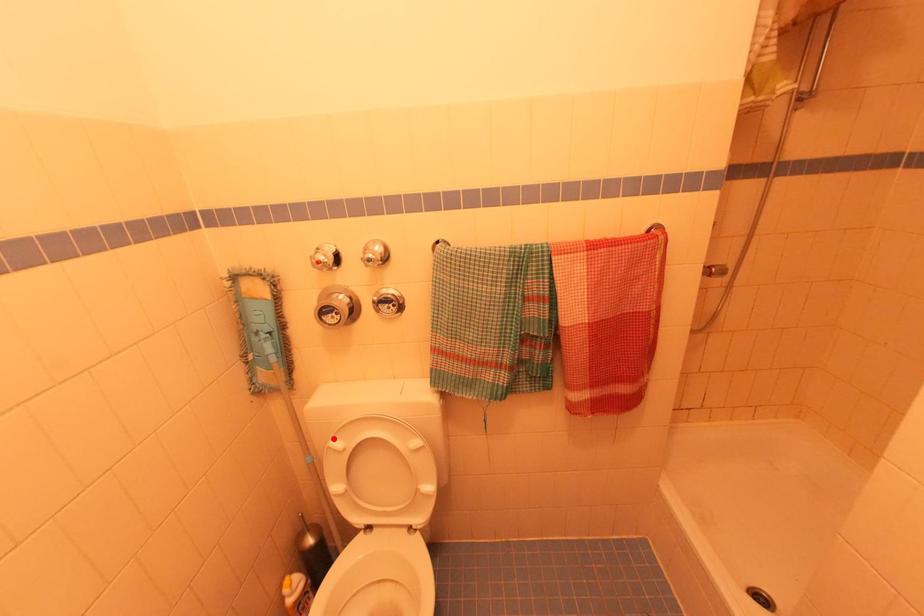
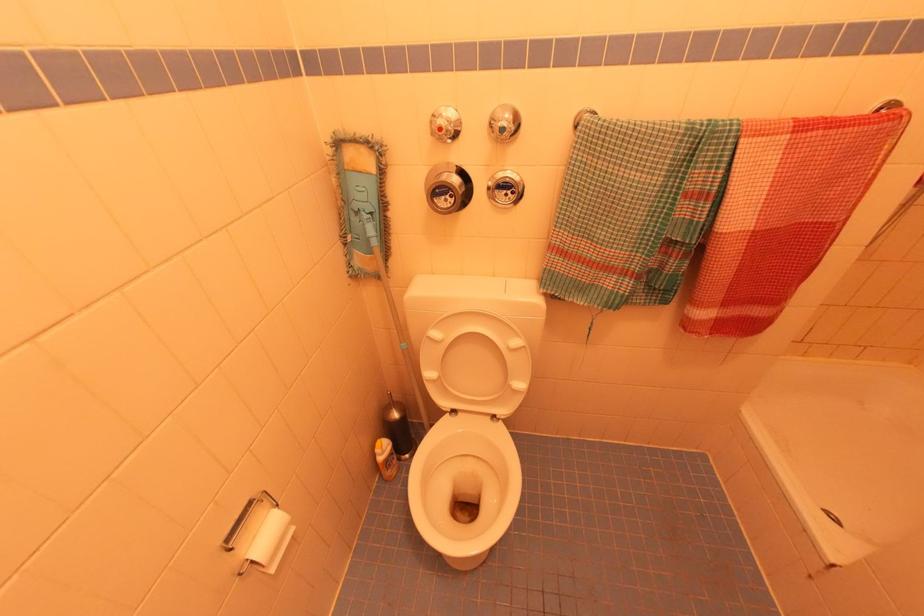
Locate, in the second image, the point that corresponds to the highlighted location in the first image.

(433, 329)